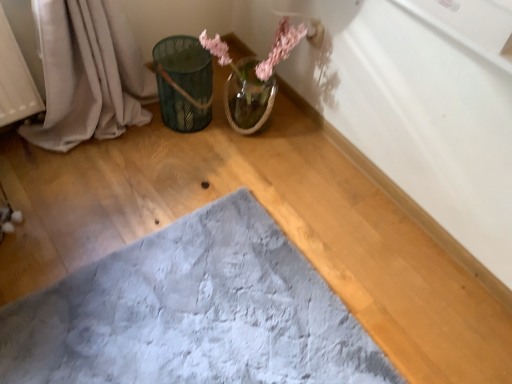
Where is `vacant space in front of translucent glass vase at upper center`? vacant space in front of translucent glass vase at upper center is located at coordinates (234, 170).